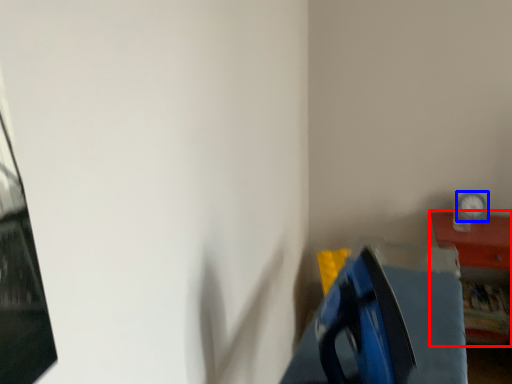
Question: Which object appears closest to the camera in this image, furniture (highlighted by a red box) or clock (highlighted by a blue box)?

Choices:
 (A) furniture
 (B) clock

Answer: (A)